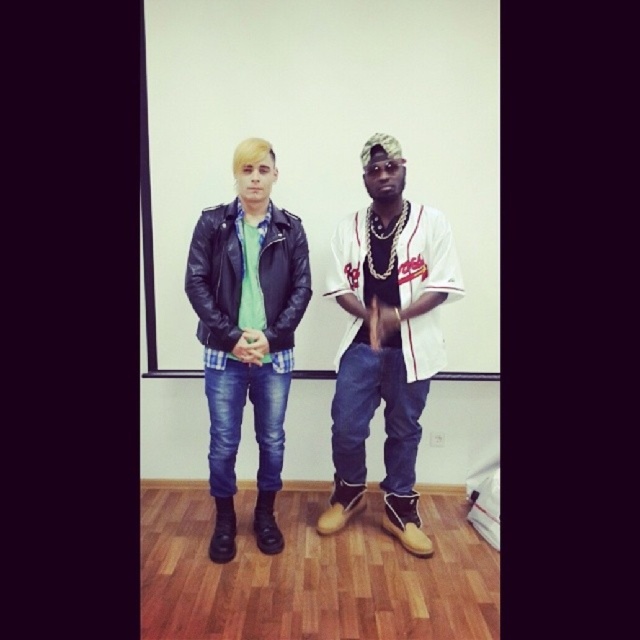
You are an interior designer planning to place a decorative item at point [248,333] in the image. What object is already present at that location?

At point [248,333] lies the matte black leather jacket at center.

You are a photographer setting up a shoot. You notice two matte black leather jackets in the scene. Which one is taller, the matte black leather jacket at center or the matte black leather jacket at left?

The matte black leather jacket at center has a greater height compared to the matte black leather jacket at left.

You are a photographer adjusting the focus on your camera. You see two points marked in the image, point (280,356) and point (237,232). Which point should you focus on first if you want to ensure the person closer to the camera is in focus?

Point (280,356) is further to the camera than point (237,232). Therefore, you should focus on point (280,356) first to ensure the closer person is in focus.